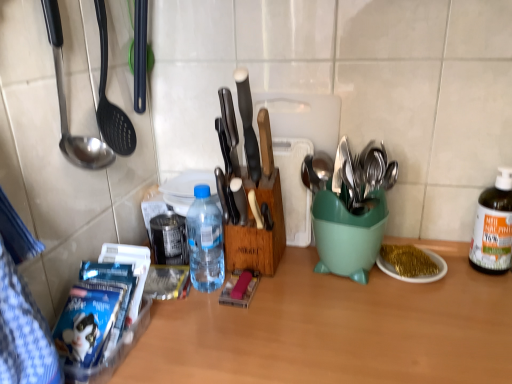
Where is `gold glitter plate at right`? This screenshot has height=384, width=512. gold glitter plate at right is located at coordinates (408, 260).

Find the location of a particular element. This screenshot has width=512, height=384. white plastic cutting board at center is located at coordinates (298, 149).

Where is `green plastic spoon holder at right`? green plastic spoon holder at right is located at coordinates (348, 234).

Find the location of a particular element. The image size is (512, 384). white plastic knife at center is located at coordinates (248, 125).

What do you see at coordinates (248, 125) in the screenshot? The image size is (512, 384). I see `white plastic knife at center` at bounding box center [248, 125].

Describe the element at coordinates (66, 107) in the screenshot. I see `stainless steel spoon at left, positioned as the 2th spoon in bottom-to-top order` at that location.

What do you see at coordinates (493, 226) in the screenshot?
I see `green plastic bottle at right, the 2th bottle when ordered from left to right` at bounding box center [493, 226].

The width and height of the screenshot is (512, 384). Describe the element at coordinates (205, 241) in the screenshot. I see `translucent plastic bottle at center, marked as the 2th bottle in a right-to-left arrangement` at that location.

This screenshot has height=384, width=512. I want to click on gold glitter plate at right, so click(x=408, y=260).

Are stainless steel spoon at left, which is the 1th spoon in front-to-back order, and translucent plastic bottle at center, marked as the 2th bottle in a right-to-left arrangement, far apart?

No, stainless steel spoon at left, which is the 1th spoon in front-to-back order, is in close proximity to translucent plastic bottle at center, marked as the 2th bottle in a right-to-left arrangement.

Is stainless steel spoon at left, which is counted as the first spoon, starting from the left, facing away from translucent plastic bottle at center, the first bottle from the left?

No, stainless steel spoon at left, which is counted as the first spoon, starting from the left, is not facing the opposite direction of translucent plastic bottle at center, the first bottle from the left.

Between stainless steel spoon at left, which is counted as the 2th spoon, starting from the right, and translucent plastic bottle at center, marked as the 2th bottle in a right-to-left arrangement, which one appears on the left side from the viewer's perspective?

From the viewer's perspective, stainless steel spoon at left, which is counted as the 2th spoon, starting from the right, appears more on the left side.

From the image's perspective, count 2nd bottles downward from the stainless steel spoon at left, which is counted as the first spoon, starting from the left, and point to it. Please provide its 2D coordinates.

[(205, 241)]

Considering the relative sizes of wooden spoon at center, the second spoon when ordered from front to back, and stainless steel spoon at left, placed as the second spoon when sorted from back to front, in the image provided, is wooden spoon at center, the second spoon when ordered from front to back, thinner than stainless steel spoon at left, placed as the second spoon when sorted from back to front,?

No, wooden spoon at center, the second spoon when ordered from front to back, is not thinner than stainless steel spoon at left, placed as the second spoon when sorted from back to front.

In terms of height, does wooden spoon at center, which is counted as the 2th spoon, starting from the top, look taller or shorter compared to stainless steel spoon at left, which is counted as the first spoon, starting from the left?

Clearly, wooden spoon at center, which is counted as the 2th spoon, starting from the top, is shorter compared to stainless steel spoon at left, which is counted as the first spoon, starting from the left.

Which object is positioned more to the left, wooden spoon at center, arranged as the first spoon when ordered from the bottom, or stainless steel spoon at left, placed as the second spoon when sorted from back to front?

stainless steel spoon at left, placed as the second spoon when sorted from back to front, is more to the left.

Is the surface of wooden spoon at center, which is counted as the 2th spoon, starting from the top, in direct contact with stainless steel spoon at left, placed as the second spoon when sorted from back to front?

wooden spoon at center, which is counted as the 2th spoon, starting from the top, and stainless steel spoon at left, placed as the second spoon when sorted from back to front, are not in contact.

Looking at their sizes, would you say white plastic cutting board at center is wider or thinner than green plastic spoon holder at right?

Considering their sizes, white plastic cutting board at center looks slimmer than green plastic spoon holder at right.

Are white plastic cutting board at center and green plastic spoon holder at right beside each other?

white plastic cutting board at center and green plastic spoon holder at right are clearly separated.

From the picture: Is white plastic cutting board at center oriented towards green plastic spoon holder at right?

Yes, white plastic cutting board at center is oriented towards green plastic spoon holder at right.

Is white plastic cutting board at center positioned in front of green plastic spoon holder at right?

No, it is not.

Considering the positions of objects wooden table at center and green plastic spoon holder at right in the image provided, who is more to the right, wooden table at center or green plastic spoon holder at right?

green plastic spoon holder at right.

Are wooden table at center and green plastic spoon holder at right located far from each other?

No.

Locate an element on the screen. mixing bowl above the wooden table at center (from the image's perspective) is located at coordinates (348, 234).

Is wooden table at center in front of or behind green plastic spoon holder at right in the image?

In the image, wooden table at center appears in front of green plastic spoon holder at right.

Does green plastic bottle at right, the 2th bottle when ordered from left to right, have a larger size compared to stainless steel spoon at left, positioned as the 2th spoon in bottom-to-top order?

No.

Which is correct: green plastic bottle at right, the 2th bottle when ordered from left to right, is inside stainless steel spoon at left, placed as the second spoon when sorted from back to front, or outside of it?

green plastic bottle at right, the 2th bottle when ordered from left to right, exists outside the volume of stainless steel spoon at left, placed as the second spoon when sorted from back to front.

Could you tell me if green plastic bottle at right, the first bottle in the right-to-left sequence, is facing stainless steel spoon at left, arranged as the 1th spoon when viewed from the top?

No, green plastic bottle at right, the first bottle in the right-to-left sequence, is not oriented towards stainless steel spoon at left, arranged as the 1th spoon when viewed from the top.

From the image's perspective, which one is positioned higher, white plastic knife at center or green plastic spoon holder at right?

white plastic knife at center.

Is point (252, 168) positioned in front of point (353, 237)?

Yes, point (252, 168) is in front of point (353, 237).

Is white plastic knife at center aimed at green plastic spoon holder at right?

No, white plastic knife at center is not facing towards green plastic spoon holder at right.

Is white plastic knife at center far from green plastic spoon holder at right?

No, white plastic knife at center is in close proximity to green plastic spoon holder at right.

The height and width of the screenshot is (384, 512). In order to click on knife that appears above the clear plastic bowl at center (from the image's perspective) in this screenshot , I will do `click(248, 125)`.

Is clear plastic bowl at center facing towards white plastic knife at center?

No, clear plastic bowl at center does not turn towards white plastic knife at center.

From a real-world perspective, between clear plastic bowl at center and white plastic knife at center, who is vertically higher?

In real-world perspective, white plastic knife at center is above.

From their relative heights in the image, would you say clear plastic bowl at center is taller or shorter than white plastic knife at center?

Clearly, clear plastic bowl at center is shorter compared to white plastic knife at center.

From a real-world perspective, starting from the stainless steel spoon at left, arranged as the 1th spoon when viewed from the top, which bottle is the 2nd one below it? Please provide its 2D coordinates.

[(205, 241)]

Find the location of a particular element. This screenshot has width=512, height=384. spoon that is below the stainless steel spoon at left, arranged as the 1th spoon when viewed from the top (from the image's perspective) is located at coordinates (239, 199).

Based on their spatial positions, is green plastic spoon holder at right or gold glitter plate at right closer to stainless steel spoon at left, which is counted as the first spoon, starting from the left?

Among the two, green plastic spoon holder at right is located nearer to stainless steel spoon at left, which is counted as the first spoon, starting from the left.

Estimate the real-world distances between objects in this image. Which object is further from translucent plastic bottle at center, the first bottle from the left, green plastic bottle at right, the first bottle in the right-to-left sequence, or wooden table at center?

green plastic bottle at right, the first bottle in the right-to-left sequence, lies further to translucent plastic bottle at center, the first bottle from the left, than the other object.

From the image, which object appears to be nearer to white plastic knife at center, white plastic cutting board at center or wooden table at center?

white plastic cutting board at center lies closer to white plastic knife at center than the other object.

Estimate the real-world distances between objects in this image. Which object is closer to gold glitter plate at right, white plastic knife at center or translucent plastic bottle at center, marked as the 2th bottle in a right-to-left arrangement?

white plastic knife at center.

Based on their spatial positions, is wooden spoon at center, which is counted as the 2th spoon, starting from the top, or white plastic knife at center further from green plastic spoon holder at right?

white plastic knife at center lies further to green plastic spoon holder at right than the other object.

Based on the photo, when comparing their distances from gold glitter plate at right, does wooden table at center or green plastic spoon holder at right seem closer?

Among the two, green plastic spoon holder at right is located nearer to gold glitter plate at right.

Which object lies nearer to the anchor point clear plastic bowl at center, gold glitter plate at right or stainless steel spoon at left, which is counted as the first spoon, starting from the left?

Among the two, stainless steel spoon at left, which is counted as the first spoon, starting from the left, is located nearer to clear plastic bowl at center.

From the image, which object appears to be farther from clear plastic bowl at center, gold glitter plate at right or wooden table at center?

gold glitter plate at right is further to clear plastic bowl at center.

Where is `cutting board positioned between wooden table at center and clear plastic bowl at center from near to far`? Image resolution: width=512 pixels, height=384 pixels. cutting board positioned between wooden table at center and clear plastic bowl at center from near to far is located at coordinates (298, 149).

You are a GUI agent. You are given a task and a screenshot of the screen. Output one action in this format:
    pyautogui.click(x=<x>, y=<y>)
    Task: Click on the mixing bowl located between wooden table at center and gold glitter plate at right in the depth direction
    This screenshot has height=384, width=512.
    Given the screenshot: What is the action you would take?
    pyautogui.click(x=348, y=234)

This screenshot has width=512, height=384. What are the coordinates of `spoon between translucent plastic bottle at center, the first bottle from the left, and white plastic cutting board at center, in the horizontal direction` in the screenshot? It's located at (239, 199).

Find the location of a particular element. Image resolution: width=512 pixels, height=384 pixels. knife between clear plastic bowl at center and green plastic bottle at right, the first bottle in the right-to-left sequence, from left to right is located at coordinates (248, 125).